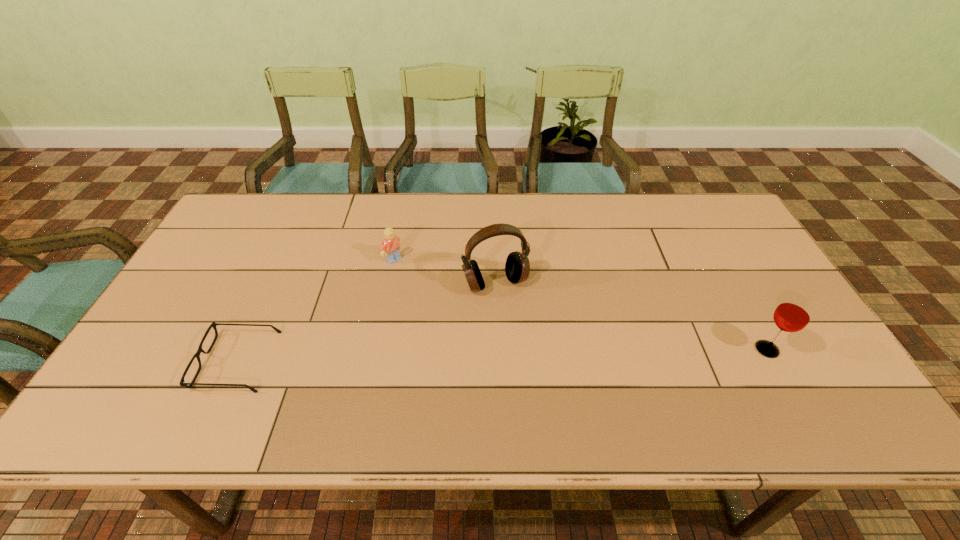
I want to click on the leftmost object, so click(x=182, y=383).

Locate an element on the screen. This screenshot has height=540, width=960. spectacles is located at coordinates (182, 383).

Identify the location of the rightmost object. The height and width of the screenshot is (540, 960). (793, 314).

I want to click on headset, so click(x=517, y=267).

Locate an element on the screen. the second farthest object is located at coordinates (517, 267).

Where is `the second shortest object`? This screenshot has width=960, height=540. the second shortest object is located at coordinates (390, 247).

The width and height of the screenshot is (960, 540). Identify the location of the third object from right to left. (390, 247).

At what (x,y) coordinates should I click in order to perform the action: click on vacant area situated on the front-facing side of the shortest object. Please return your answer as a coordinate pair (x, y). Looking at the image, I should click on (146, 361).

The image size is (960, 540). I want to click on free spot located on the front-facing side of the shortest object, so click(171, 361).

The width and height of the screenshot is (960, 540). I want to click on free spot located on the front-facing side of the shortest object, so click(179, 361).